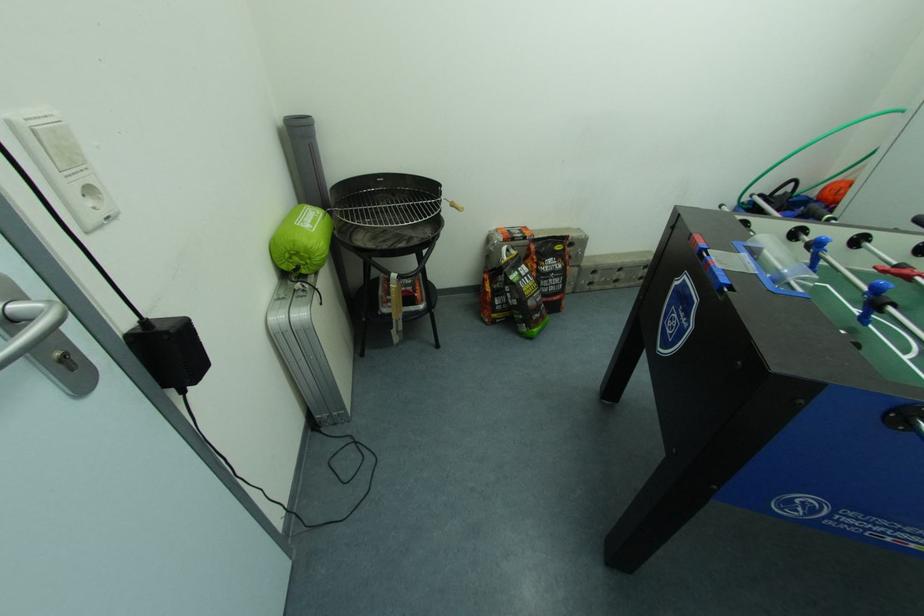
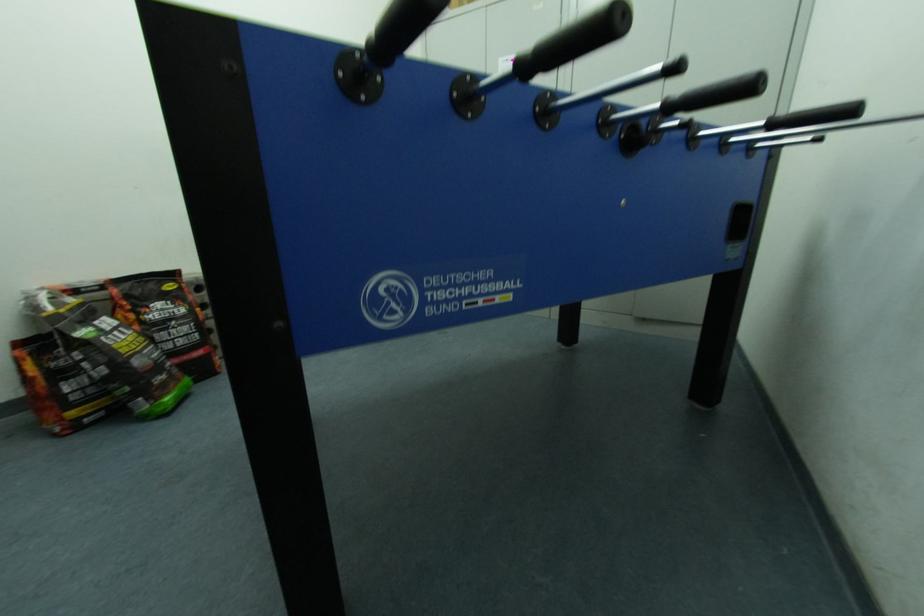
Question: How did the camera likely rotate?

Choices:
 (A) Left
 (B) Right
 (C) Up
 (D) Down

Answer: (B)